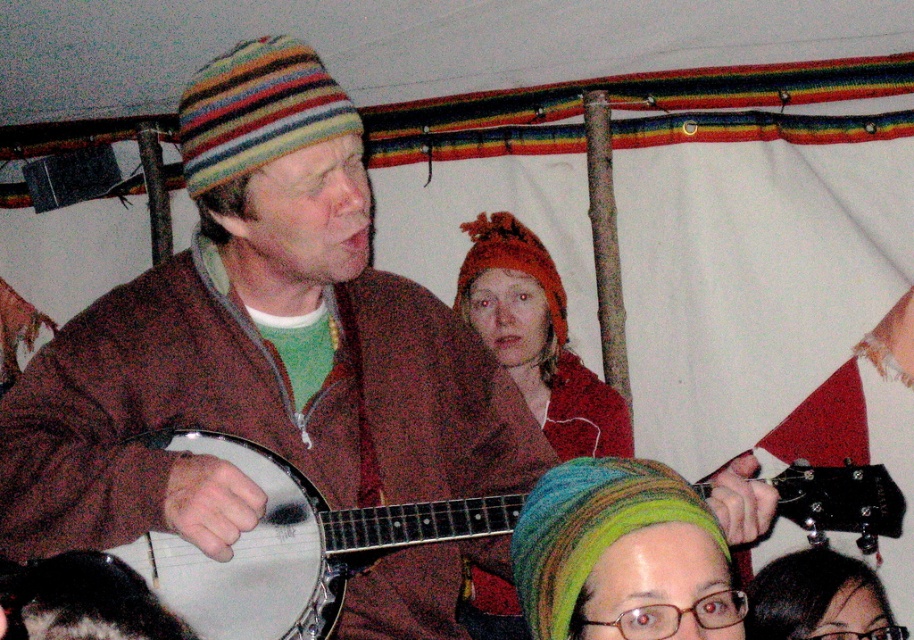
You are a photographer trying to capture a closeup of the white matte banjo at center without including the matte brown jacket at center in the frame. Given their relative sizes and positions, is this possible?

The matte brown jacket at center is taller than the white matte banjo at center, so if positioned directly in front of the banjo, it might block the view. However, if the photographer can angle the camera to focus solely on the banjo while moving around the jacket, it might be possible to exclude the jacket from the frame.

You are a stagehand who needs to place a microphone stand between the matte brown jacket at center and the knitted woolen hat at center. The stand requires 2 feet of space to be placed safely. Is there enough space between them?

The distance between the matte brown jacket at center and the knitted woolen hat at center is 3.32 feet, which is more than the required 2 feet. Therefore, there is sufficient space to place the microphone stand safely between them.

You are a photographer at the event and want to take a photo of the knitted woolen hat at center without the matte brown jacket at center blocking it. Is this possible given their positions?

A: The matte brown jacket at center is in front of the knitted woolen hat at center, so it is blocking the view. Therefore, you cannot take a photo of the knitted woolen hat at center without the matte brown jacket at center blocking it.